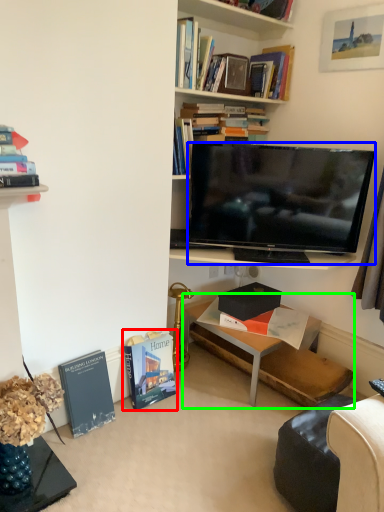
Question: Which is farther away from book (highlighted by a red box)? television (highlighted by a blue box) or table (highlighted by a green box)?

Choices:
 (A) television
 (B) table

Answer: (A)